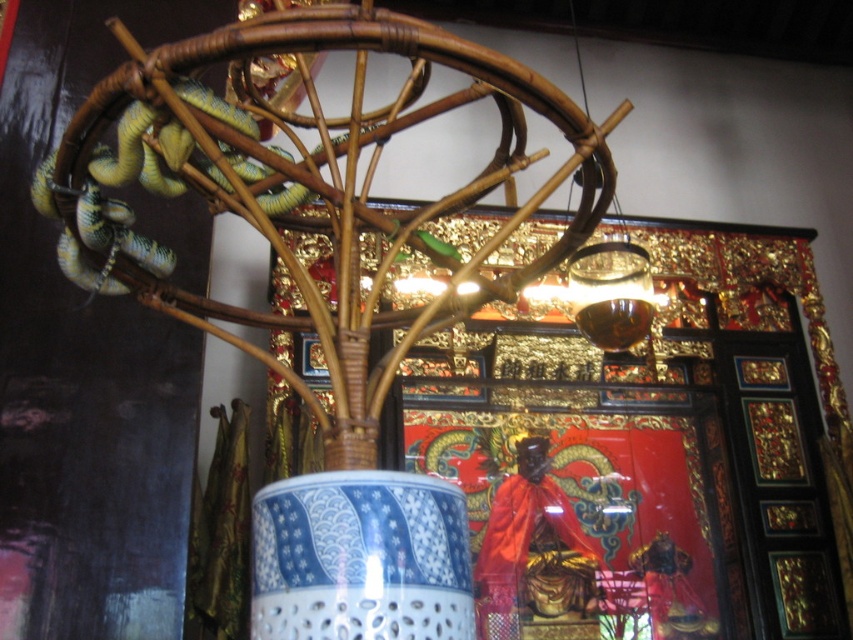
Does blue porcelain vase at center have a greater width compared to green glossy snake at upper left?

Incorrect, blue porcelain vase at center's width does not surpass green glossy snake at upper left's.

Between blue porcelain vase at center and green glossy snake at upper left, which one has less height?

With less height is blue porcelain vase at center.

Is point (415, 573) farther from camera compared to point (102, 218)?

No, it is in front of (102, 218).

This screenshot has width=853, height=640. I want to click on blue porcelain vase at center, so click(x=360, y=557).